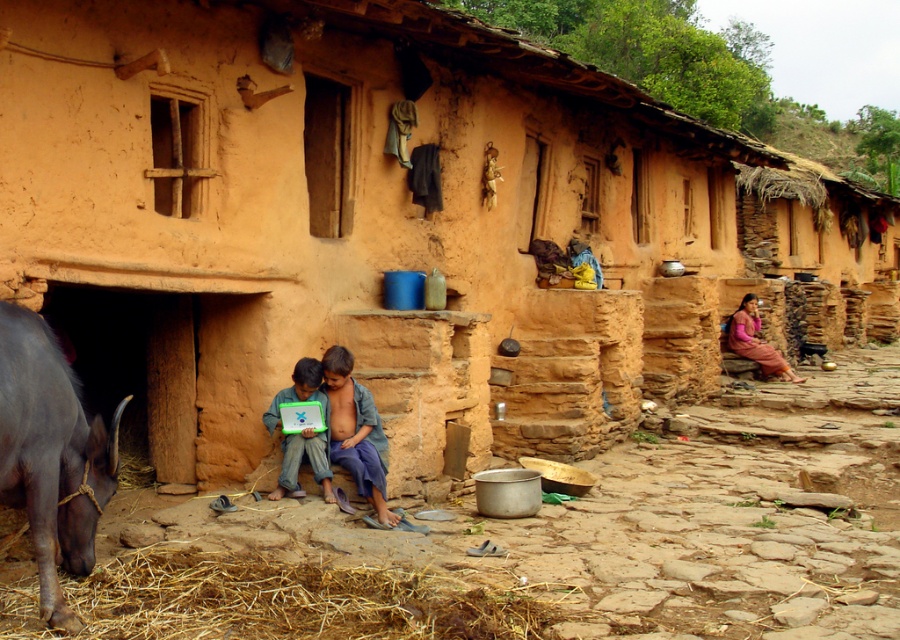
Question: Which object is positioned closest to the dark gray fur at lower left?

Choices:
 (A) blue denim shirt at center
 (B) brown straw at lower left

Answer: (B)

Question: Which point is closer to the camera?

Choices:
 (A) (3, 362)
 (B) (315, 381)
 (C) (360, 451)
 (D) (428, 584)

Answer: (A)

Question: Can you confirm if dark gray fur at lower left is positioned to the left of pink fabric skirt at right?

Choices:
 (A) yes
 (B) no

Answer: (A)

Question: Is brown straw at lower left thinner than dark gray fur at lower left?

Choices:
 (A) yes
 (B) no

Answer: (B)

Question: From the image, what is the correct spatial relationship of brown straw at lower left in relation to blue denim shirt at center?

Choices:
 (A) right
 (B) left

Answer: (B)

Question: Which object is farther from the camera taking this photo?

Choices:
 (A) matte green laptop at lower center
 (B) dark gray fur at lower left

Answer: (A)